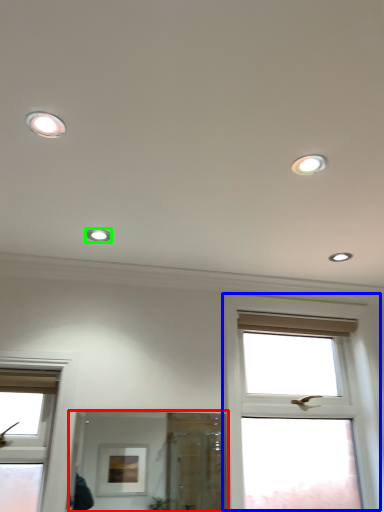
Question: Which object is positioned farthest from mirror (highlighted by a red box)? Select from window (highlighted by a blue box) and dot (highlighted by a green box).

Choices:
 (A) window
 (B) dot

Answer: (B)